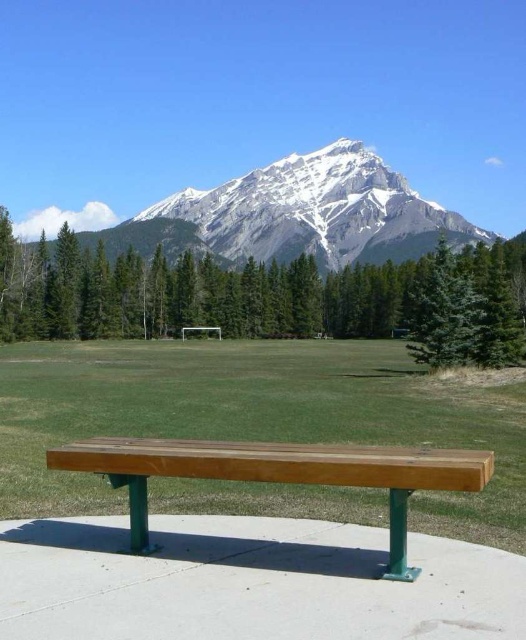
Which is below, wooden bench at center or green textured pine tree at right?

wooden bench at center is below.

Is wooden bench at center positioned at the back of green textured pine tree at right?

No, it is in front of green textured pine tree at right.

Which is in front, point (347, 451) or point (437, 296)?

Positioned in front is point (347, 451).

Where is `wooden bench at center`? The width and height of the screenshot is (526, 640). wooden bench at center is located at coordinates (278, 474).

Does snowy granite mountain at upper center appear over green textured pine tree at right?

Indeed, snowy granite mountain at upper center is positioned over green textured pine tree at right.

Which of these two, snowy granite mountain at upper center or green textured pine tree at right, stands taller?

With more height is snowy granite mountain at upper center.

Does point (116, 244) lie behind point (464, 285)?

Yes, point (116, 244) is farther from viewer.

Identify the location of snowy granite mountain at upper center. (298, 214).

Can you confirm if green grass at center is wider than wooden bench at center?

Yes.

Does green grass at center appear under wooden bench at center?

Yes.

The image size is (526, 640). I want to click on green grass at center, so click(250, 417).